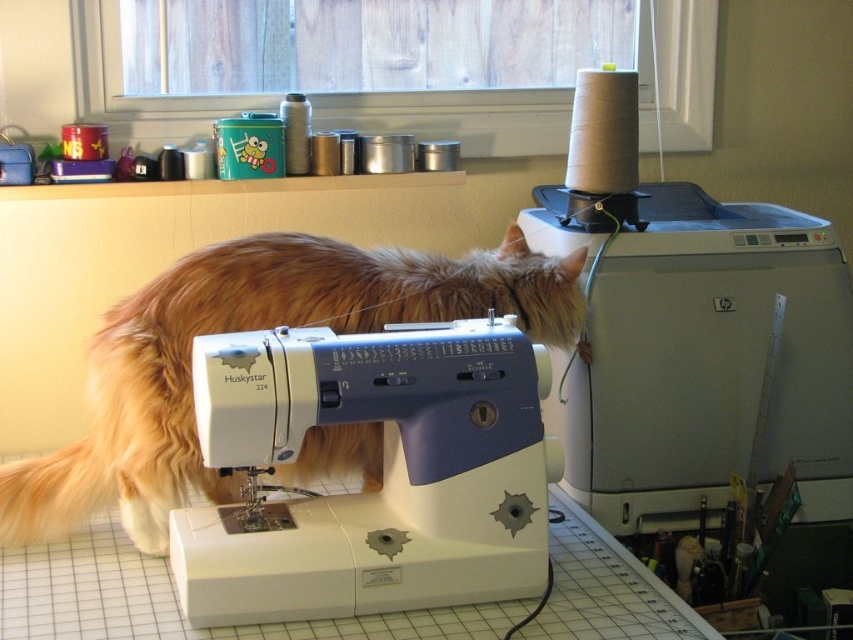
Question: Which object is the closest to the white plastic sewing machine at upper right?

Choices:
 (A) golden fur cat at center
 (B) white plastic sewing machine at center

Answer: (A)

Question: Does white plastic sewing machine at center have a smaller size compared to golden fur cat at center?

Choices:
 (A) no
 (B) yes

Answer: (B)

Question: Which object is positioned farthest from the white plastic sewing machine at upper right?

Choices:
 (A) white plastic sewing machine at center
 (B) golden fur cat at center

Answer: (A)

Question: Is white plastic sewing machine at center closer to camera compared to golden fur cat at center?

Choices:
 (A) yes
 (B) no

Answer: (A)

Question: Does white plastic sewing machine at upper right come in front of white plastic sewing machine at center?

Choices:
 (A) no
 (B) yes

Answer: (A)

Question: Which point is farther to the camera?

Choices:
 (A) (373, 531)
 (B) (137, 301)

Answer: (B)